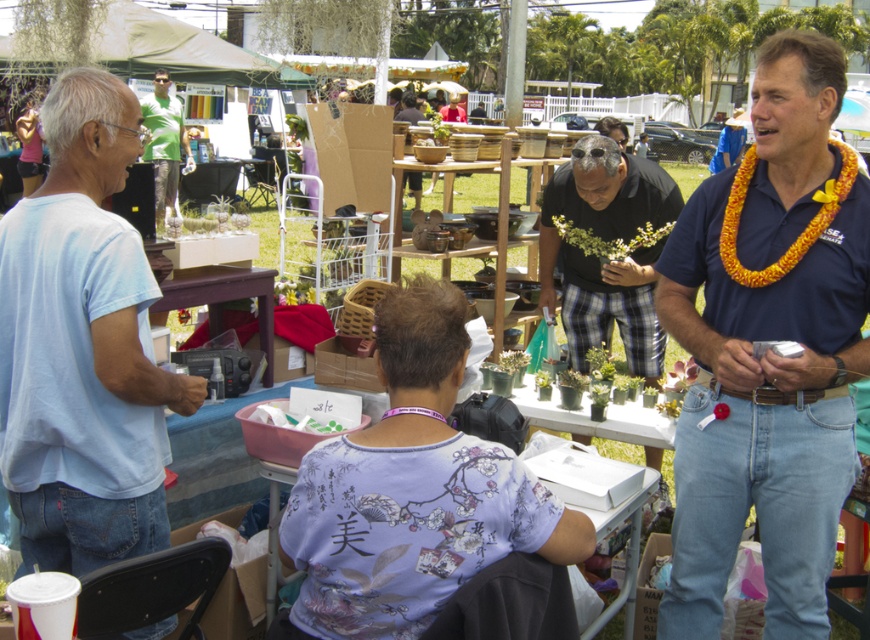
Question: Which point is farther to the camera?

Choices:
 (A) (382, 593)
 (B) (74, 348)
 (C) (835, 504)

Answer: (C)

Question: Does blue shirt at center appear under matte black shirt at center?

Choices:
 (A) yes
 (B) no

Answer: (A)

Question: Which of the following is the farthest from the observer?

Choices:
 (A) blue shirt at center
 (B) brown wood table at lower left

Answer: (B)

Question: Does purple fabric table at center appear over matte black shirt at center?

Choices:
 (A) yes
 (B) no

Answer: (B)

Question: Is light blue cotton shirt at left smaller than purple fabric table at center?

Choices:
 (A) no
 (B) yes

Answer: (A)

Question: Which is farther from the green fabric shirt at upper left?

Choices:
 (A) light blue cotton shirt at left
 (B) brown wood table at lower left
 (C) matte black shirt at center

Answer: (A)